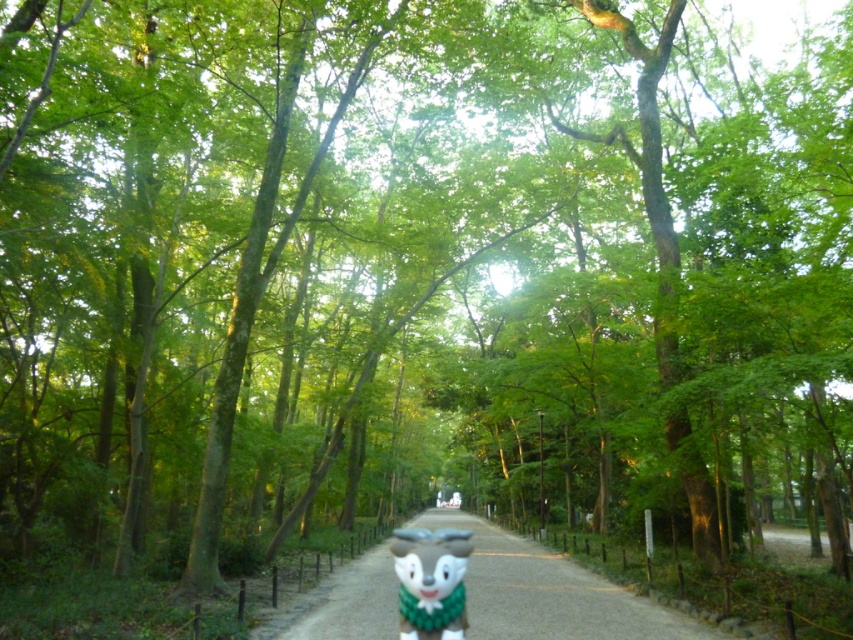
You are standing on the forest pathway and want to reach a hidden spring located exactly at the end of the smooth gravel path at center. If your walking speed is 1.5 meters per second, how many seconds will it take you to reach the spring?

The smooth gravel path at center is 6.58 meters away from viewer. At a speed of 1.5 meters per second, it will take approximately 4.39 seconds to reach the spring.

Consider the image. You are walking on the smooth gravel path at center and see the green plush toy at center. Which object is taller?

The green plush toy at center is taller than the smooth gravel path at center.